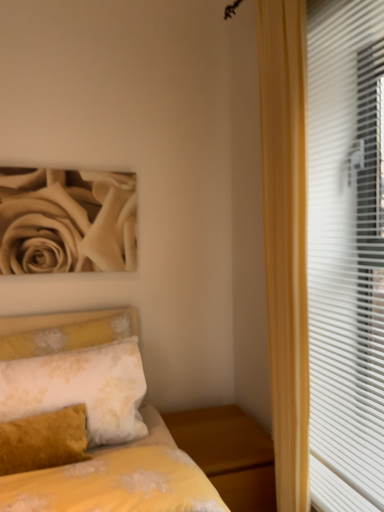
Question: Considering the relative positions of white floral fabric pillow at lower left and yellow floral fabric bed at lower left in the image provided, is white floral fabric pillow at lower left behind yellow floral fabric bed at lower left?

Choices:
 (A) no
 (B) yes

Answer: (B)

Question: From the image's perspective, does white floral fabric pillow at lower left appear higher than yellow floral fabric bed at lower left?

Choices:
 (A) no
 (B) yes

Answer: (B)

Question: Is white floral fabric pillow at lower left to the left of yellow floral fabric bed at lower left from the viewer's perspective?

Choices:
 (A) no
 (B) yes

Answer: (B)

Question: Can you confirm if white floral fabric pillow at lower left is wider than yellow floral fabric bed at lower left?

Choices:
 (A) yes
 (B) no

Answer: (B)

Question: From a real-world perspective, is white floral fabric pillow at lower left on top of yellow floral fabric bed at lower left?

Choices:
 (A) no
 (B) yes

Answer: (B)

Question: Is point (114, 223) closer or farther from the camera than point (122, 361)?

Choices:
 (A) farther
 (B) closer

Answer: (A)

Question: Which is correct: beige matte rose at upper left is inside white floral fabric pillow at lower left, or outside of it?

Choices:
 (A) outside
 (B) inside

Answer: (A)

Question: Is beige matte rose at upper left wider or thinner than white floral fabric pillow at lower left?

Choices:
 (A) thin
 (B) wide

Answer: (A)

Question: Considering the positions of beige matte rose at upper left and white floral fabric pillow at lower left in the image, is beige matte rose at upper left taller or shorter than white floral fabric pillow at lower left?

Choices:
 (A) tall
 (B) short

Answer: (A)

Question: Is wooden nightstand at lower right bigger or smaller than beige matte rose at upper left?

Choices:
 (A) big
 (B) small

Answer: (A)

Question: Does point (228, 434) appear closer or farther from the camera than point (84, 245)?

Choices:
 (A) closer
 (B) farther

Answer: (A)

Question: From a real-world perspective, relative to beige matte rose at upper left, is wooden nightstand at lower right vertically above or below?

Choices:
 (A) above
 (B) below

Answer: (B)

Question: In terms of width, does wooden nightstand at lower right look wider or thinner when compared to beige matte rose at upper left?

Choices:
 (A) wide
 (B) thin

Answer: (A)

Question: Considering the positions of point (137, 395) and point (379, 301), is point (137, 395) closer or farther from the camera than point (379, 301)?

Choices:
 (A) farther
 (B) closer

Answer: (A)

Question: From the image's perspective, relative to white plastic blinds at right, is white floral fabric pillow at lower left above or below?

Choices:
 (A) below
 (B) above

Answer: (A)